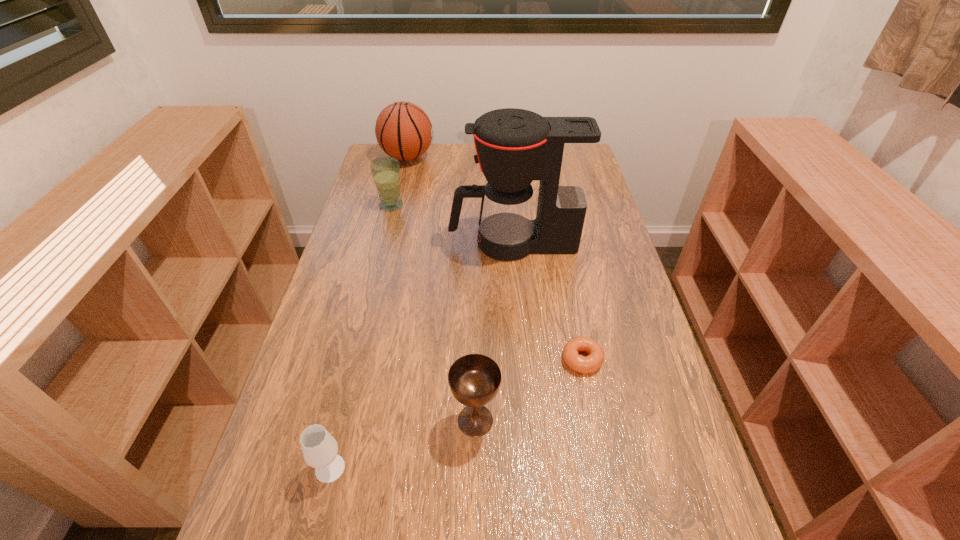
In order to click on vacant point located between the nearer glass and the coffee maker in this screenshot , I will do `click(421, 356)`.

Locate an element on the screen. vacant area between the second farthest object and the fifth farthest object is located at coordinates (433, 313).

Where is `vacant area between the chalice and the doughnut`? vacant area between the chalice and the doughnut is located at coordinates (529, 390).

Identify the location of vacant area that lies between the nearer glass and the basketball. (369, 313).

Identify which object is the fifth nearest to the fifth shortest object. Please provide its 2D coordinates. Your answer should be formatted as a tuple, i.e. [(x, y)], where the tuple contains the x and y coordinates of a point satisfying the conditions above.

[(319, 447)]

The image size is (960, 540). Find the location of `object that is the second closest one to the second tallest object`. object that is the second closest one to the second tallest object is located at coordinates (514, 146).

At what (x,y) coordinates should I click in order to perform the action: click on vacant space that satisfies the following two spatial constraints: 1. on the side where the inflation valve is located; 2. on the left side of the fifth farthest object. Please return your answer as a coordinate pair (x, y). Looking at the image, I should click on (345, 420).

I want to click on blank space that satisfies the following two spatial constraints: 1. pour from the carafe of the shortest object; 2. on the left side of the fourth nearest object, so click(x=522, y=359).

This screenshot has width=960, height=540. I want to click on free point that satisfies the following two spatial constraints: 1. on the side where the inflation valve is located; 2. on the right side of the doughnut, so click(x=359, y=359).

Identify the location of free spot that satisfies the following two spatial constraints: 1. on the side where the inflation valve is located; 2. on the right side of the basketball. The height and width of the screenshot is (540, 960). (345, 420).